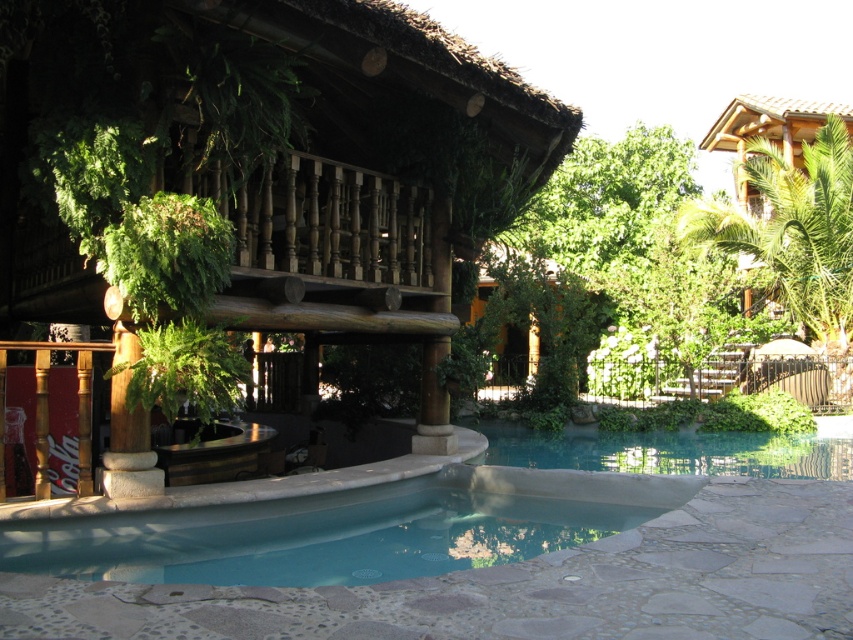
You are standing in the pool area and want to walk from point (577, 241) to point (833, 220). Which direction should you face to move towards your destination?

Since point (577, 241) is closer to you than point (833, 220), you should face away from the camera to move towards point (833, 220).

You are standing at the edge of the pool and want to look towards the green leafy tree at upper right. In which direction should you turn from facing the blue smooth water at center?

You should turn to your right because the green leafy tree at upper right is located to the right of the blue smooth water at center.